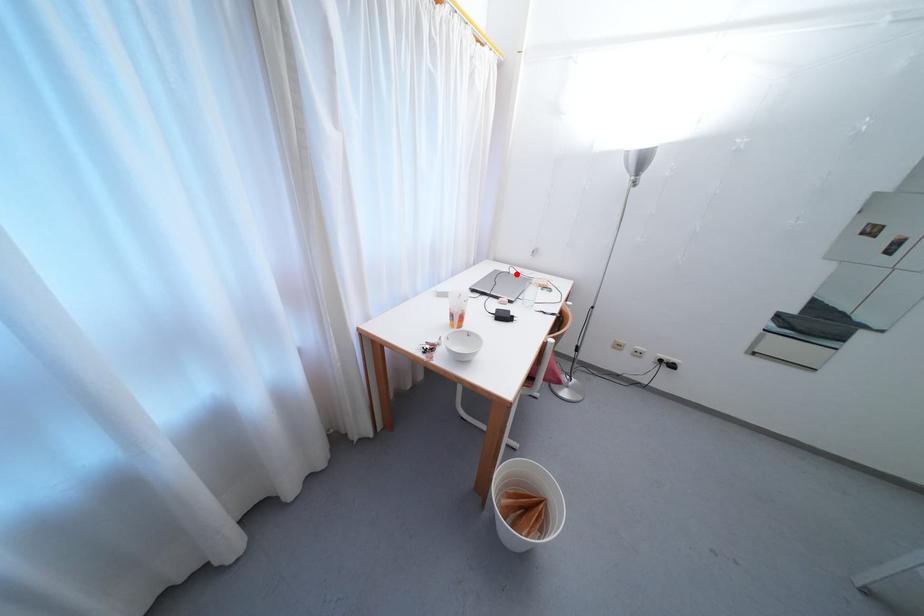
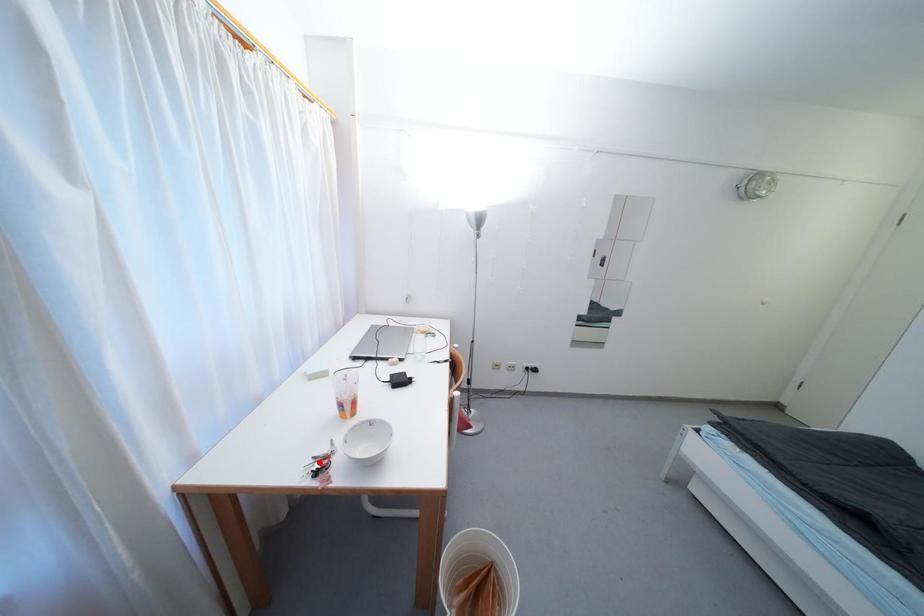
I am providing you with two images of the same scene from different viewpoints. A red point is marked on the first image and another point is marked on the second image. Do the highlighted points in image1 and image2 indicate the same real-world spot?

No